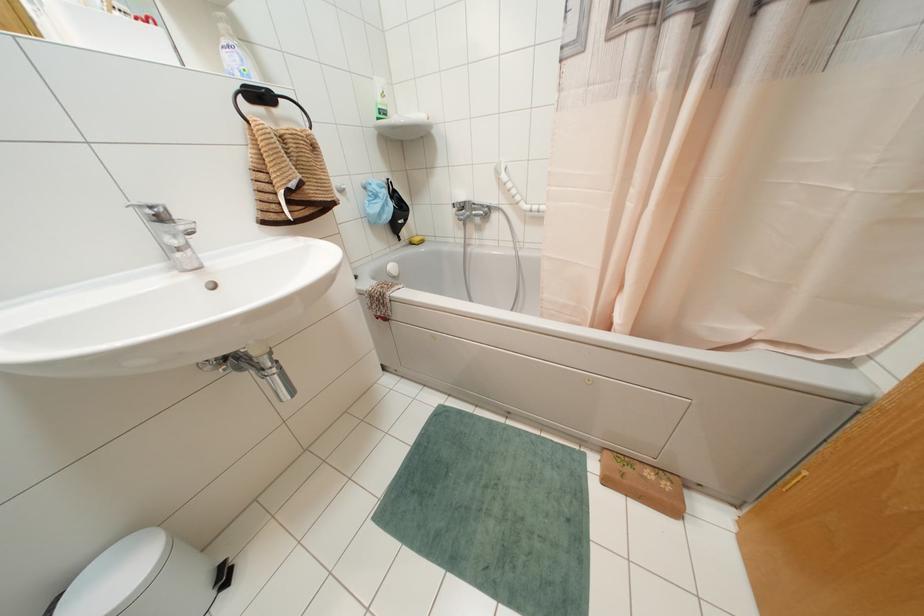
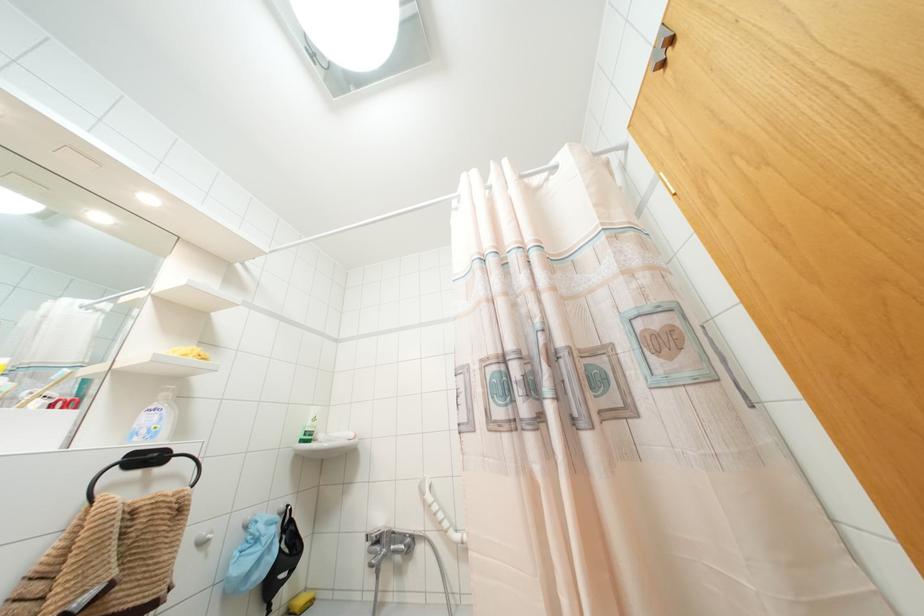
The images are taken continuously from a first-person perspective. In which direction is your viewpoint rotating?

The camera rotated toward right-up.